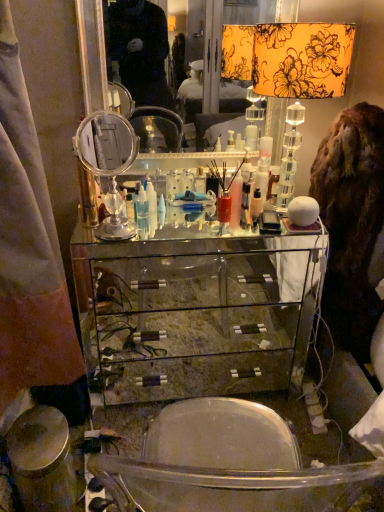
Question: Considering their positions, is satin fabric curtain at left located in front of or behind clear glass cabinet at center?

Choices:
 (A) front
 (B) behind

Answer: (A)

Question: From the image's perspective, is satin fabric curtain at left located above or below clear glass cabinet at center?

Choices:
 (A) below
 (B) above

Answer: (B)

Question: Which of these objects is positioned closest to the floral fabric lampshade at upper right, placed as the 2th table lamp when sorted from left to right?

Choices:
 (A) clear glass mirror at center
 (B) satin fabric curtain at left
 (C) translucent plastic bottle at center, which appears as the 2th toiletry when viewed from the left
 (D) white plastic cone at center, the 2th toiletry in the top-to-bottom sequence
 (E) brown furry coat at right

Answer: (E)

Question: Which object is positioned closest to the floral fabric lampshade at upper right, placed as the 2th table lamp when sorted from left to right?

Choices:
 (A) polished silver mirror at center, the first table lamp in the left-to-right sequence
 (B) white plastic cone at center, the second toiletry viewed from the right
 (C) clear glass mirror at center
 (D) translucent plastic bottle at center, the 1th toiletry from the top
 (E) satin fabric curtain at left

Answer: (D)